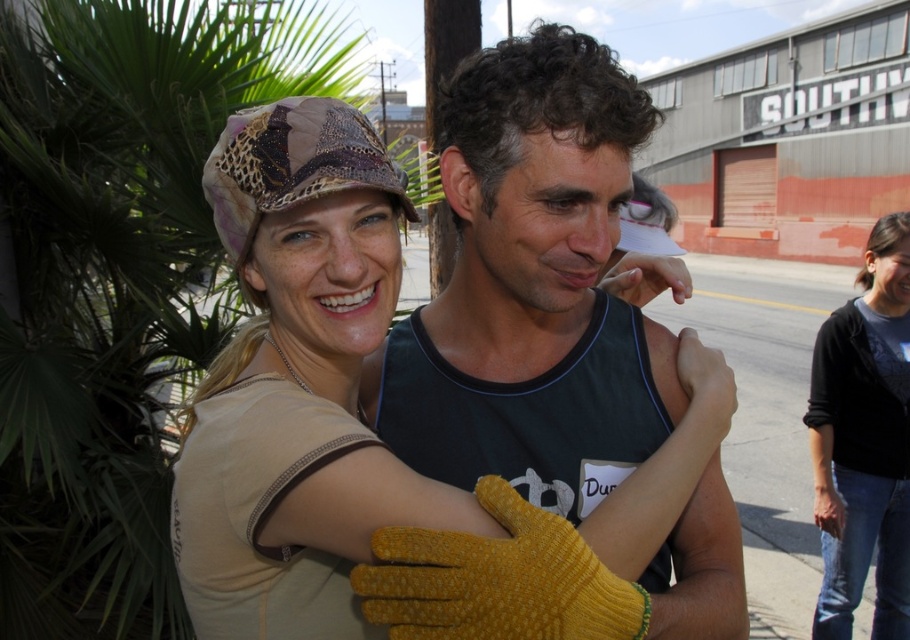
Between matte green tank top at center and black cotton shirt at lower right, which one has more height?

Standing taller between the two is black cotton shirt at lower right.

Who is more distant from viewer, (546,376) or (838,636)?

Point (838,636)

Between point (716, 632) and point (823, 593), which one is positioned behind?

Point (823, 593)

The height and width of the screenshot is (640, 910). In order to click on matte green tank top at center in this screenshot , I will do `click(531, 288)`.